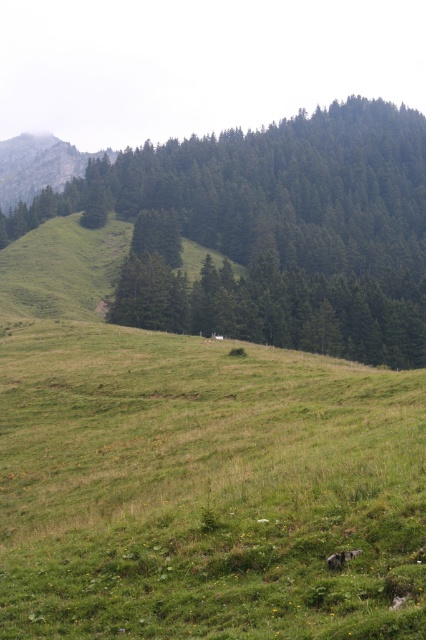
You are standing in the meadow and want to take a photo of both the green leafy tree at center and the rugged stone mountain at upper left. Which object should you focus on first to ensure both are in clear view?

You should focus on the green leafy tree at center first because it is closer to you than the rugged stone mountain at upper left, ensuring both are in focus.

You are planning to take a photo of the green leafy tree at center and the rugged stone mountain at upper left. Which object should you focus on first if you want to capture both in the same frame without moving the camera?

The green leafy tree at center is positioned under rugged stone mountain at upper left, so you should focus on the green leafy tree at center first to ensure both are in focus since it is closer to the camera.

You are planning to plant a new tree in this meadow. The tree you want to plant requires a minimum of 10 meters of vertical space to grow properly. Given the green leafy tree at center and the rugged stone mountain at upper left, which one would be the better reference point for determining if there is enough vertical space?

The green leafy tree at center has a greater height compared to the rugged stone mountain at upper left. Since the tree requires 10 meters of vertical space, and the green leafy tree at center is taller than the mountain, you should use the height of the green leafy tree at center as the reference. If the tree can reach that height, it should have sufficient space.